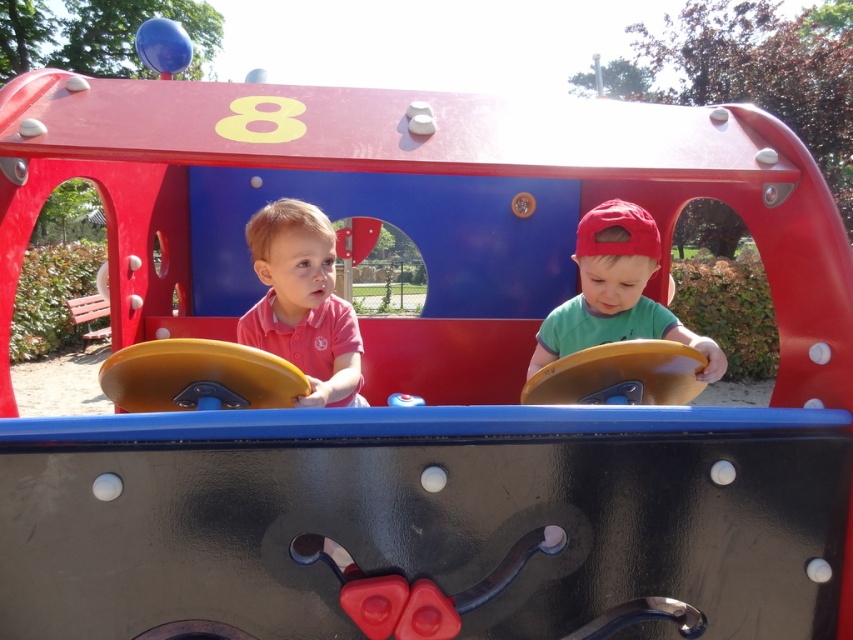
Where is the matte pink shirt at center located in the image?

The matte pink shirt at center is located at point 0.473 on the x axis and 0.355 on the y axis.

You are a photographer trying to capture both the matte pink shirt at center and the green matte shirt at center in a single shot. Based on their positions, which shirt should you focus on first to ensure both are in frame?

The matte pink shirt at center is positioned under the green matte shirt at center, so you should focus on the green matte shirt at center first to ensure both are in frame.

You are a photographer trying to capture both the matte pink shirt at center and the green matte shirt at center in a single frame. Based on their sizes in the image, which child should you position closer to the camera to ensure both are clearly visible?

Since the matte pink shirt at center is smaller than the green matte shirt at center, you should position the child wearing the matte pink shirt at center closer to the camera to balance their apparent sizes in the photo.